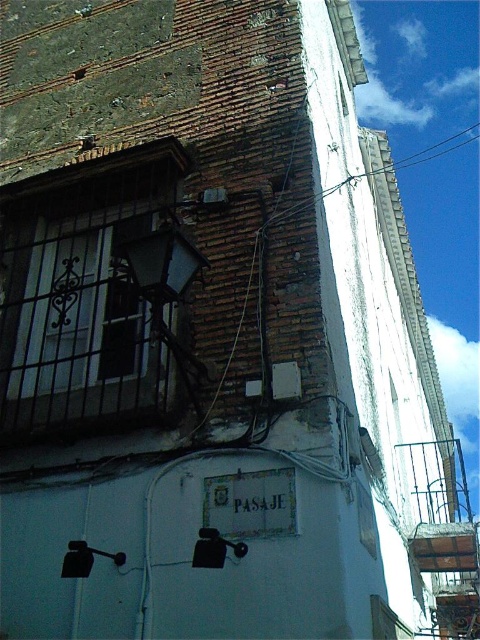
Looking at this image, you are an electrician inspecting the building. You notice the brown wire at center and the white plastic power line at upper center. Which object is closer to you from your current viewpoint?

The brown wire at center is closer to you because it is in front of the white plastic power line at upper center.